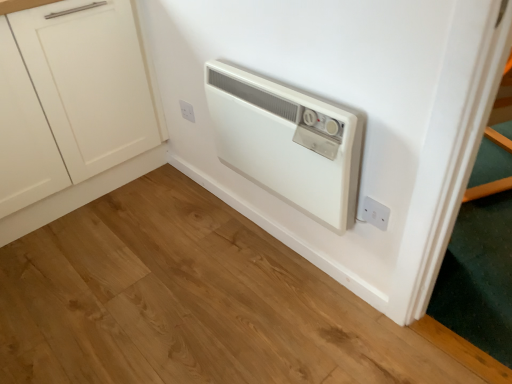
The image size is (512, 384). I want to click on white matte cabinet at left, so click(84, 107).

What is the approximate width of white plastic heater at center?

The width of white plastic heater at center is 4.24 inches.

Image resolution: width=512 pixels, height=384 pixels. In order to click on white plastic heater at center in this screenshot , I will do `click(287, 142)`.

At what (x,y) coordinates should I click in order to perform the action: click on white matte cabinet at left. Please return your answer as a coordinate pair (x, y). Looking at the image, I should click on (84, 107).

From the image's perspective, which one is positioned lower, white plastic electric outlet at lower right, placed as the 2th electric outlet when sorted from top to bottom, or white plastic heater at center?

white plastic electric outlet at lower right, placed as the 2th electric outlet when sorted from top to bottom.

Does white plastic electric outlet at lower right, marked as the 1th electric outlet in a bottom-to-top arrangement, appear on the left side of white plastic heater at center?

No.

Could you tell me if white plastic electric outlet at lower right, the 1th electric outlet in the front-to-back sequence, is facing white plastic heater at center?

No, white plastic electric outlet at lower right, the 1th electric outlet in the front-to-back sequence, is not facing towards white plastic heater at center.

In terms of size, does white plastic electric outlet at lower right, which appears as the first electric outlet when viewed from the right, appear bigger or smaller than white plastic heater at center?

Considering their sizes, white plastic electric outlet at lower right, which appears as the first electric outlet when viewed from the right, takes up less space than white plastic heater at center.

In terms of width, does white plastic electric outlet at lower right, marked as the 1th electric outlet in a bottom-to-top arrangement, look wider or thinner when compared to white matte cabinet at left?

white plastic electric outlet at lower right, marked as the 1th electric outlet in a bottom-to-top arrangement, is thinner than white matte cabinet at left.

This screenshot has width=512, height=384. I want to click on cabinetry above the white plastic electric outlet at lower right, which appears as the first electric outlet when viewed from the right (from the image's perspective), so [x=84, y=107].

Is white plastic electric outlet at lower right, which is the 2th electric outlet in left-to-right order, far from white matte cabinet at left?

Yes, white plastic electric outlet at lower right, which is the 2th electric outlet in left-to-right order, and white matte cabinet at left are located far from each other.

Which object is positioned more to the right, white plastic electric outlet at lower right, the 1th electric outlet in the front-to-back sequence, or white matte cabinet at left?

white plastic electric outlet at lower right, the 1th electric outlet in the front-to-back sequence, is more to the right.

From their relative heights in the image, would you say white plastic electric outlet at upper center, placed as the second electric outlet when sorted from front to back, is taller or shorter than white plastic electric outlet at lower right, which is counted as the second electric outlet, starting from the back?

In the image, white plastic electric outlet at upper center, placed as the second electric outlet when sorted from front to back, appears to be shorter than white plastic electric outlet at lower right, which is counted as the second electric outlet, starting from the back.

Can you confirm if white plastic electric outlet at upper center, positioned as the 1th electric outlet in top-to-bottom order, is thinner than white plastic electric outlet at lower right, which is the 2th electric outlet in left-to-right order?

No, white plastic electric outlet at upper center, positioned as the 1th electric outlet in top-to-bottom order, is not thinner than white plastic electric outlet at lower right, which is the 2th electric outlet in left-to-right order.

From the image's perspective, is white plastic electric outlet at upper center, which is counted as the first electric outlet, starting from the back, positioned above or below white plastic electric outlet at lower right, which appears as the first electric outlet when viewed from the right?

From the image's perspective, white plastic electric outlet at upper center, which is counted as the first electric outlet, starting from the back, appears above white plastic electric outlet at lower right, which appears as the first electric outlet when viewed from the right.

Measure the distance from white matte cabinet at left to white plastic heater at center.

The distance of white matte cabinet at left from white plastic heater at center is 28.91 inches.

This screenshot has width=512, height=384. Find the location of `home appliance below the white matte cabinet at left (from the image's perspective)`. home appliance below the white matte cabinet at left (from the image's perspective) is located at coordinates (287, 142).

Considering the sizes of objects white matte cabinet at left and white plastic heater at center in the image provided, who is smaller, white matte cabinet at left or white plastic heater at center?

white plastic heater at center.

Which is behind, white matte cabinet at left or white plastic heater at center?

white matte cabinet at left is further away from the camera.

Which of these two, white plastic electric outlet at upper center, positioned as the 1th electric outlet in top-to-bottom order, or white matte cabinet at left, is bigger?

white matte cabinet at left.

Between point (188, 110) and point (105, 33), which one is positioned in front?

The point (105, 33) is closer to the camera.

Is white plastic electric outlet at upper center, positioned as the 1th electric outlet in top-to-bottom order, far from white matte cabinet at left?

white plastic electric outlet at upper center, positioned as the 1th electric outlet in top-to-bottom order, is near white matte cabinet at left, not far away.

Could you measure the distance between white plastic electric outlet at upper center, arranged as the second electric outlet when viewed from the right, and white matte cabinet at left?

A distance of 17.96 inches exists between white plastic electric outlet at upper center, arranged as the second electric outlet when viewed from the right, and white matte cabinet at left.

Does white matte cabinet at left have a smaller size compared to white plastic electric outlet at lower right, marked as the 1th electric outlet in a bottom-to-top arrangement?

No.

From the image's perspective, is white matte cabinet at left located beneath white plastic electric outlet at lower right, the 1th electric outlet in the front-to-back sequence?

Incorrect, from the image's perspective, white matte cabinet at left is higher than white plastic electric outlet at lower right, the 1th electric outlet in the front-to-back sequence.

From a real-world perspective, is white matte cabinet at left beneath white plastic electric outlet at lower right, which is counted as the second electric outlet, starting from the back?

No, from a real-world perspective, white matte cabinet at left is not under white plastic electric outlet at lower right, which is counted as the second electric outlet, starting from the back.

Is white plastic heater at center behind white plastic electric outlet at upper center, placed as the second electric outlet when sorted from front to back?

No, white plastic heater at center is closer to the viewer.

Which of these two, white plastic heater at center or white plastic electric outlet at upper center, placed as the second electric outlet when sorted from front to back, is smaller?

white plastic electric outlet at upper center, placed as the second electric outlet when sorted from front to back.

Is white plastic heater at center placed right next to white plastic electric outlet at upper center, which is counted as the 2th electric outlet, starting from the bottom?

white plastic heater at center and white plastic electric outlet at upper center, which is counted as the 2th electric outlet, starting from the bottom, are not in contact.

The height and width of the screenshot is (384, 512). Find the location of `electric outlet below the white plastic heater at center (from the image's perspective)`. electric outlet below the white plastic heater at center (from the image's perspective) is located at coordinates (375, 213).

In the image, there is a white plastic electric outlet at lower right, which is the 2th electric outlet in left-to-right order. Where is `cabinetry above it (from the image's perspective)`? This screenshot has height=384, width=512. cabinetry above it (from the image's perspective) is located at coordinates (84, 107).

When comparing their distances from white plastic electric outlet at upper center, placed as the second electric outlet when sorted from front to back, does white plastic heater at center or white plastic electric outlet at lower right, placed as the 2th electric outlet when sorted from top to bottom, seem closer?

white plastic heater at center is positioned closer to the anchor white plastic electric outlet at upper center, placed as the second electric outlet when sorted from front to back.

Based on their spatial positions, is white plastic electric outlet at lower right, which is the 2th electric outlet in left-to-right order, or white plastic electric outlet at upper center, which is counted as the 2th electric outlet, starting from the bottom, further from white matte cabinet at left?

white plastic electric outlet at lower right, which is the 2th electric outlet in left-to-right order, is further to white matte cabinet at left.

From the image, which object appears to be nearer to white plastic electric outlet at lower right, placed as the 2th electric outlet when sorted from top to bottom, white matte cabinet at left or white plastic heater at center?

Based on the image, white plastic heater at center appears to be nearer to white plastic electric outlet at lower right, placed as the 2th electric outlet when sorted from top to bottom.

From the picture: From the image, which object appears to be farther from white plastic electric outlet at upper center, which is counted as the 2th electric outlet, starting from the bottom, white matte cabinet at left or white plastic heater at center?

white plastic heater at center lies further to white plastic electric outlet at upper center, which is counted as the 2th electric outlet, starting from the bottom, than the other object.

Considering their positions, is white plastic electric outlet at lower right, marked as the 1th electric outlet in a bottom-to-top arrangement, positioned further to white plastic electric outlet at upper center, placed as the second electric outlet when sorted from front to back, than white matte cabinet at left?

Among the two, white plastic electric outlet at lower right, marked as the 1th electric outlet in a bottom-to-top arrangement, is located further to white plastic electric outlet at upper center, placed as the second electric outlet when sorted from front to back.

From the image, which object appears to be nearer to white plastic heater at center, white plastic electric outlet at lower right, placed as the 2th electric outlet when sorted from top to bottom, or white matte cabinet at left?

Among the two, white plastic electric outlet at lower right, placed as the 2th electric outlet when sorted from top to bottom, is located nearer to white plastic heater at center.

Which object lies further to the anchor point white plastic electric outlet at upper center, which is counted as the 2th electric outlet, starting from the bottom, white matte cabinet at left or white plastic electric outlet at lower right, marked as the 1th electric outlet in a bottom-to-top arrangement?

Based on the image, white plastic electric outlet at lower right, marked as the 1th electric outlet in a bottom-to-top arrangement, appears to be further to white plastic electric outlet at upper center, which is counted as the 2th electric outlet, starting from the bottom.

Based on their spatial positions, is white plastic electric outlet at upper center, placed as the second electric outlet when sorted from front to back, or white plastic heater at center closer to white matte cabinet at left?

white plastic electric outlet at upper center, placed as the second electric outlet when sorted from front to back, is positioned closer to the anchor white matte cabinet at left.

Where is `home appliance between white matte cabinet at left and white plastic electric outlet at lower right, the 1th electric outlet in the front-to-back sequence`? The height and width of the screenshot is (384, 512). home appliance between white matte cabinet at left and white plastic electric outlet at lower right, the 1th electric outlet in the front-to-back sequence is located at coordinates (287, 142).

Where is `electric outlet situated between white matte cabinet at left and white plastic electric outlet at lower right, which is the 2th electric outlet in left-to-right order, from left to right`? The width and height of the screenshot is (512, 384). electric outlet situated between white matte cabinet at left and white plastic electric outlet at lower right, which is the 2th electric outlet in left-to-right order, from left to right is located at coordinates (187, 111).

The image size is (512, 384). Identify the location of electric outlet situated between white matte cabinet at left and white plastic heater at center from left to right. (187, 111).

At what (x,y) coordinates should I click in order to perform the action: click on electric outlet located between white plastic heater at center and white plastic electric outlet at upper center, which is counted as the 2th electric outlet, starting from the bottom, in the depth direction. Please return your answer as a coordinate pair (x, y). The width and height of the screenshot is (512, 384). Looking at the image, I should click on (375, 213).